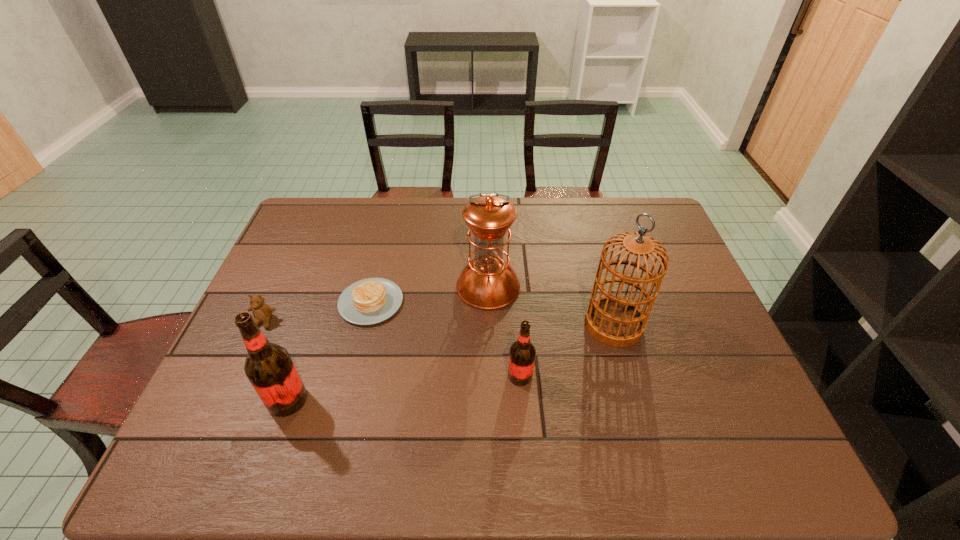
At what (x,y) coordinates should I click in order to perform the action: click on the left root beer. Please return your answer as a coordinate pair (x, y). Looking at the image, I should click on (268, 366).

I want to click on the second object from left to right, so click(x=268, y=366).

Identify the location of the right root beer. This screenshot has width=960, height=540. (522, 353).

The height and width of the screenshot is (540, 960). Find the location of `the fourth tallest object`. the fourth tallest object is located at coordinates 522,353.

Identify the location of the fourth object from right to left. The height and width of the screenshot is (540, 960). (369, 301).

Locate an element on the screen. This screenshot has width=960, height=540. pancake is located at coordinates click(369, 301).

The height and width of the screenshot is (540, 960). What are the coordinates of `the second shortest object` in the screenshot? It's located at (262, 312).

Locate an element on the screen. the leftmost object is located at coordinates (262, 312).

Where is `the rightmost object`? the rightmost object is located at coordinates point(613,320).

You are a GUI agent. You are given a task and a screenshot of the screen. Output one action in this format:
    pyautogui.click(x=<x>, y=<y>)
    Task: Click on the oil lamp
    This screenshot has width=960, height=540.
    Given the screenshot: What is the action you would take?
    pyautogui.click(x=488, y=282)